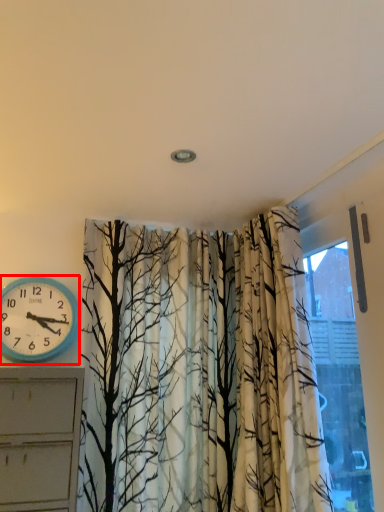
Question: From the image's perspective, where is wall clock (annotated by the red box) located in relation to window in the image?

Choices:
 (A) below
 (B) above

Answer: (B)